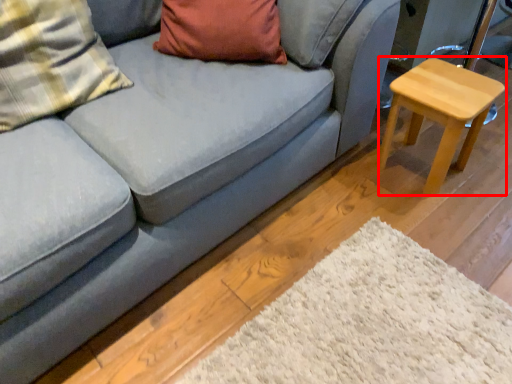
Question: From the image's perspective, considering the relative positions of stool (annotated by the red box) and pillow in the image provided, where is stool (annotated by the red box) located with respect to the staircase?

Choices:
 (A) below
 (B) above

Answer: (A)